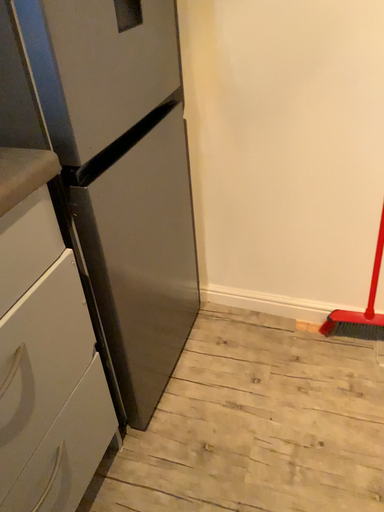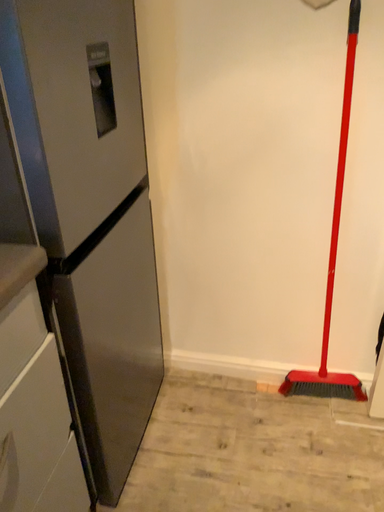
Question: Which way did the camera rotate in the video?

Choices:
 (A) rotated left
 (B) rotated right

Answer: (B)